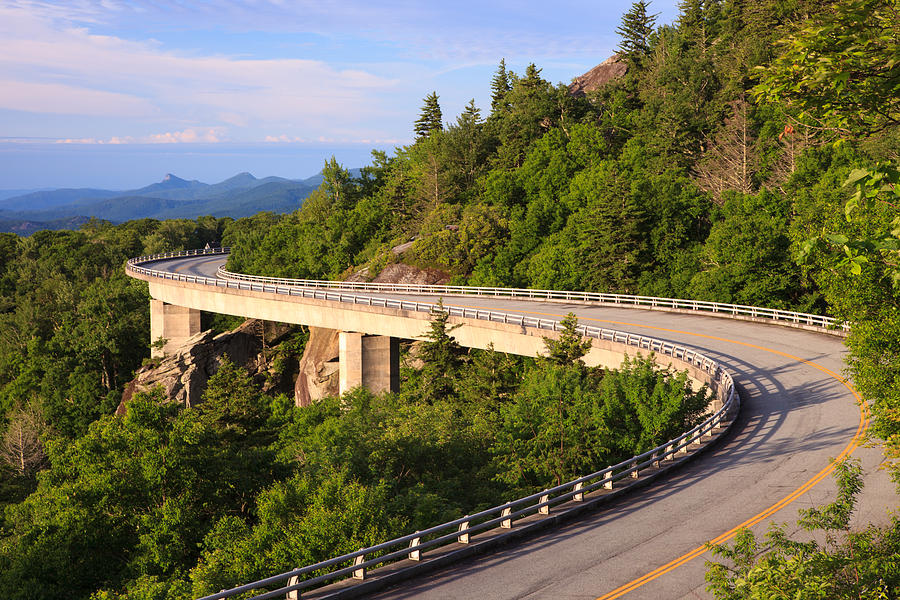
You are a GUI agent. You are given a task and a screenshot of the screen. Output one action in this format:
    pyautogui.click(x=<x>, y=<y>)
    Task: Click on the large concrete pillar
    Image resolution: width=900 pixels, height=600 pixels.
    Given the screenshot: What is the action you would take?
    pyautogui.click(x=364, y=353), pyautogui.click(x=165, y=326)